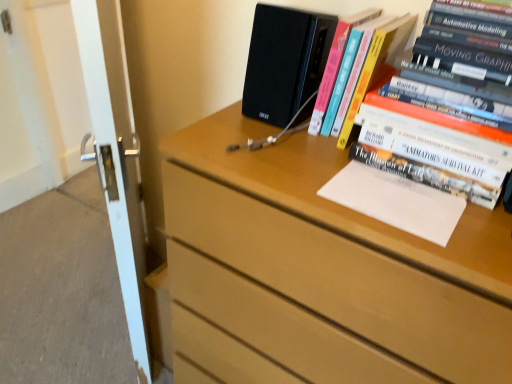
Question: Considering the relative sizes of hardcover books at upper right, positioned as the 2th book in left-to-right order, and white paper at upper right in the image provided, is hardcover books at upper right, positioned as the 2th book in left-to-right order, wider than white paper at upper right?

Choices:
 (A) no
 (B) yes

Answer: (B)

Question: From a real-world perspective, is hardcover books at upper right, positioned as the 2th book in left-to-right order, positioned under white paper at upper right based on gravity?

Choices:
 (A) yes
 (B) no

Answer: (B)

Question: From the image's perspective, is hardcover books at upper right, positioned as the 2th book in left-to-right order, located beneath white paper at upper right?

Choices:
 (A) yes
 (B) no

Answer: (B)

Question: From a real-world perspective, does hardcover books at upper right, positioned as the 2th book in left-to-right order, stand above white paper at upper right?

Choices:
 (A) no
 (B) yes

Answer: (B)

Question: Is hardcover books at upper right, which is the 1th book in right-to-left order, to the left of white paper at upper right from the viewer's perspective?

Choices:
 (A) yes
 (B) no

Answer: (B)

Question: Considering the relative sizes of hardcover books at upper right, which is the 1th book in right-to-left order, and white paper at upper right in the image provided, is hardcover books at upper right, which is the 1th book in right-to-left order, taller than white paper at upper right?

Choices:
 (A) no
 (B) yes

Answer: (B)

Question: Does white glossy screen door at left appear on the right side of white paper at upper right?

Choices:
 (A) no
 (B) yes

Answer: (A)

Question: From a real-world perspective, is white glossy screen door at left on white paper at upper right?

Choices:
 (A) yes
 (B) no

Answer: (B)

Question: Are white glossy screen door at left and white paper at upper right far apart?

Choices:
 (A) no
 (B) yes

Answer: (A)

Question: From the image's perspective, is white glossy screen door at left over white paper at upper right?

Choices:
 (A) no
 (B) yes

Answer: (B)

Question: Considering the relative sizes of white glossy screen door at left and white paper at upper right in the image provided, is white glossy screen door at left shorter than white paper at upper right?

Choices:
 (A) yes
 (B) no

Answer: (B)

Question: Is white paper at upper right located within white glossy screen door at left?

Choices:
 (A) no
 (B) yes

Answer: (A)

Question: From a real-world perspective, does wooden chest of drawers at upper right sit lower than white paper at upper right?

Choices:
 (A) yes
 (B) no

Answer: (A)